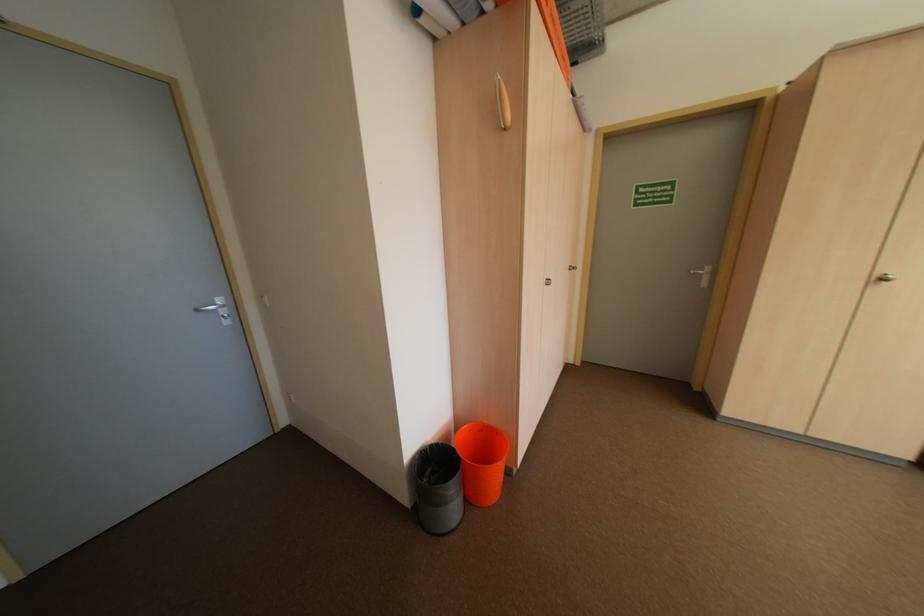
Where is `silver door handle`? The height and width of the screenshot is (616, 924). silver door handle is located at coordinates (214, 307).